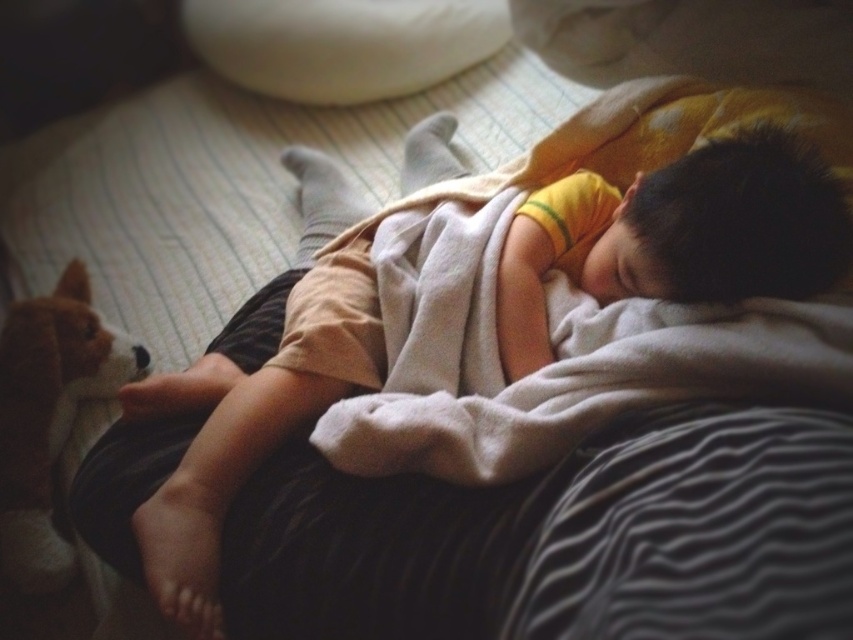
Question: Does white soft pillow at upper center have a larger size compared to brown plush dog at lower left?

Choices:
 (A) no
 (B) yes

Answer: (A)

Question: Which point is farther to the camera?

Choices:
 (A) (297, 300)
 (B) (27, 515)
 (C) (218, 51)

Answer: (C)

Question: Is soft yellow shirt at center behind white soft pillow at upper center?

Choices:
 (A) yes
 (B) no

Answer: (B)

Question: Estimate the real-world distances between objects in this image. Which object is closer to the white soft pillow at upper center?

Choices:
 (A) brown plush dog at lower left
 (B) soft yellow shirt at center

Answer: (A)

Question: Which object is positioned closest to the white soft pillow at upper center?

Choices:
 (A) brown plush dog at lower left
 (B) soft yellow shirt at center

Answer: (A)

Question: Does soft yellow shirt at center have a larger size compared to brown plush dog at lower left?

Choices:
 (A) no
 (B) yes

Answer: (B)